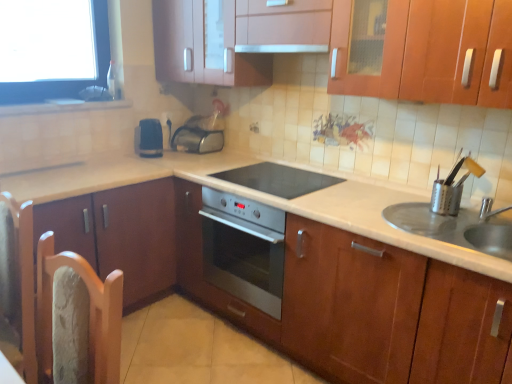
Question: Is black plastic toaster at center, the 2th appliance viewed from the top, wider or thinner than metallic silver utensil holder at right, which is the 1th appliance in right-to-left order?

Choices:
 (A) wide
 (B) thin

Answer: (A)

Question: Would you say black plastic toaster at center, placed as the second appliance when sorted from back to front, is to the left or to the right of metallic silver utensil holder at right, which is the 1th appliance in right-to-left order, in the picture?

Choices:
 (A) left
 (B) right

Answer: (A)

Question: Which of these objects is positioned farthest from the wooden chair at left?

Choices:
 (A) metallic silver utensil holder at right, which is the third appliance in left-to-right order
 (B) black plastic toaster at center, the second appliance positioned from the bottom
 (C) wooden cabinet at upper center, positioned as the first cabinetry in right-to-left order
 (D) metallic silver outlet at center
 (E) black glass cooktop at center

Answer: (D)

Question: Considering the real-world distances, which object is farthest from the metallic silver toaster at center, acting as the second appliance starting from the left?

Choices:
 (A) white glossy exhaust hood at upper center
 (B) wooden cabinet at upper center, positioned as the first cabinetry in right-to-left order
 (C) wooden chair at left
 (D) black plastic toaster at center, the 1th appliance positioned from the left
 (E) white glossy countertop at center

Answer: (C)